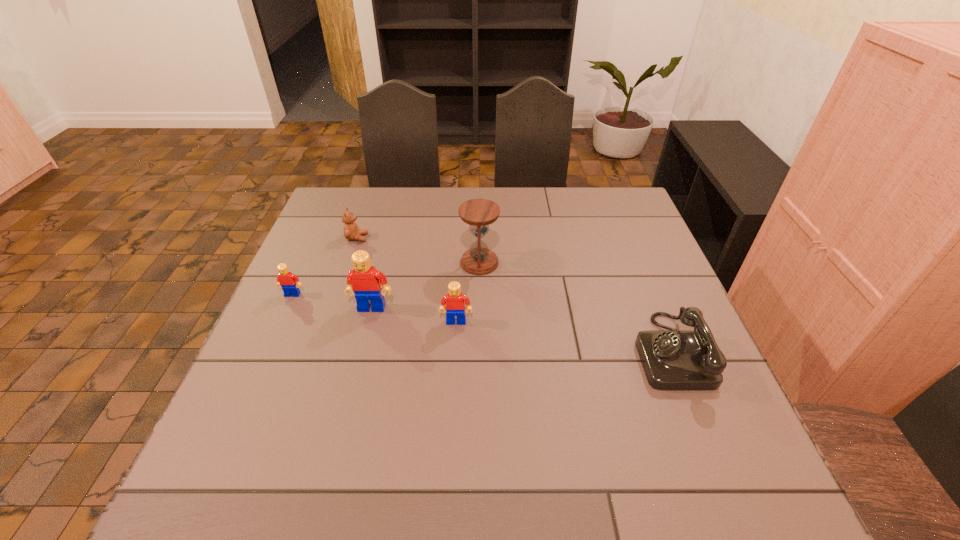
The width and height of the screenshot is (960, 540). Identify the location of vacant position located 0.210m on the front-facing side of the shortest Lego. (261, 365).

Where is `vacant space located 0.080m on the front-facing side of the second nearest Lego`? vacant space located 0.080m on the front-facing side of the second nearest Lego is located at coordinates (364, 339).

You are a GUI agent. You are given a task and a screenshot of the screen. Output one action in this format:
    pyautogui.click(x=<x>, y=<y>)
    Task: Click on the free location located 0.180m on the front-facing side of the second tallest Lego
    
    Given the screenshot: What is the action you would take?
    pyautogui.click(x=452, y=391)

Locate an element on the screen. vacant space situated 0.110m on the left of the second farthest object is located at coordinates (420, 262).

Identify the location of free space located 0.330m on the face of the second object from left to right. (479, 238).

The image size is (960, 540). What are the coordinates of `free space located 0.080m on the dial of the rightmost object` in the screenshot? It's located at (602, 351).

Where is `free space located 0.240m on the dial of the rightmost object`? The height and width of the screenshot is (540, 960). free space located 0.240m on the dial of the rightmost object is located at coordinates (530, 351).

I want to click on vacant space located 0.130m on the dial of the rightmost object, so pyautogui.click(x=579, y=351).

This screenshot has width=960, height=540. Identify the location of Lego at the left edge. (285, 278).

Identify the location of teddy bear at the left edge. The image size is (960, 540). (351, 232).